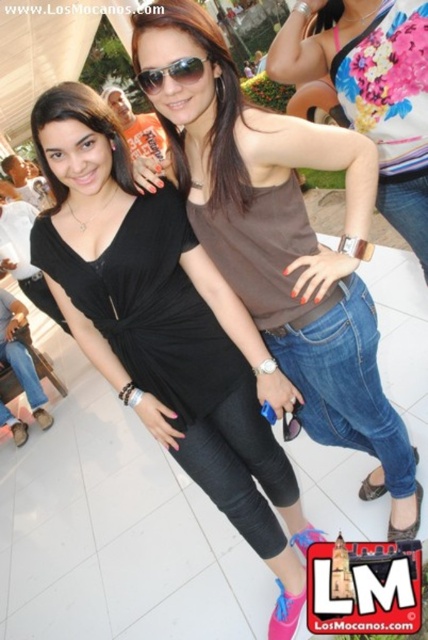
The width and height of the screenshot is (428, 640). I want to click on black matte tank top at center, so click(166, 330).

The height and width of the screenshot is (640, 428). What are the coordinates of `black matte tank top at center` in the screenshot? It's located at (166, 330).

Find the location of `brown fabric tank top at center`. brown fabric tank top at center is located at coordinates (371, 90).

Can you confirm if brown fabric tank top at center is positioned to the right of sunglasses at center?

Indeed, brown fabric tank top at center is positioned on the right side of sunglasses at center.

Where is `brown fabric tank top at center`? The height and width of the screenshot is (640, 428). brown fabric tank top at center is located at coordinates (371, 90).

This screenshot has width=428, height=640. Identify the location of brown fabric tank top at center. (371, 90).

This screenshot has height=640, width=428. In order to click on black matte tank top at center in this screenshot , I will do `click(166, 330)`.

Which is behind, point (71, 224) or point (181, 64)?

Point (71, 224)

This screenshot has width=428, height=640. I want to click on black matte tank top at center, so click(166, 330).